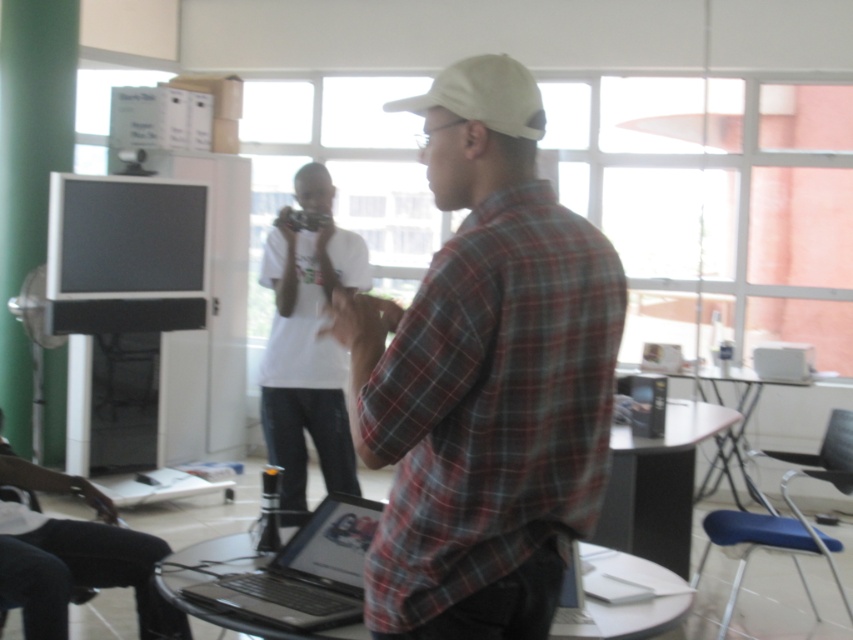
Question: Which of these objects is positioned farthest from the white plastic computer at right?

Choices:
 (A) plaid fabric shirt at center
 (B) white matte shirt at center
 (C) white matte baseball cap at center
 (D) dark gray fabric pants at lower left

Answer: (A)

Question: Is white matte shirt at center thinner than white plastic computer at right?

Choices:
 (A) yes
 (B) no

Answer: (B)

Question: Does white matte t-shirt at center appear over black glossy laptop at center?

Choices:
 (A) no
 (B) yes

Answer: (B)

Question: Which of the following is the closest to the observer?

Choices:
 (A) dark gray fabric pants at lower left
 (B) white matte baseball cap at center

Answer: (B)

Question: Which is farther from the black glossy laptop at center?

Choices:
 (A) blue fabric stool at lower right
 (B) white matte t-shirt at center

Answer: (A)

Question: From the image, what is the correct spatial relationship of plaid fabric shirt at center in relation to white matte baseball cap at center?

Choices:
 (A) below
 (B) above

Answer: (A)